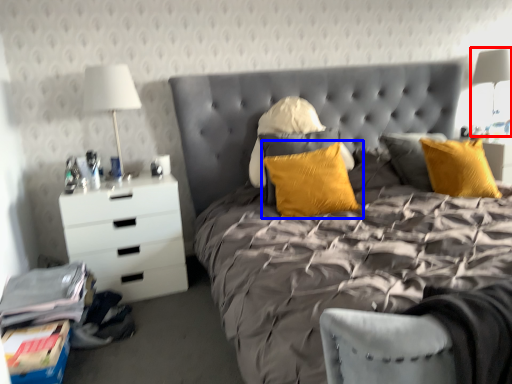
Question: Which of the following is the farthest to the observer, bedside lamp (highlighted by a red box) or pillow (highlighted by a blue box)?

Choices:
 (A) bedside lamp
 (B) pillow

Answer: (A)